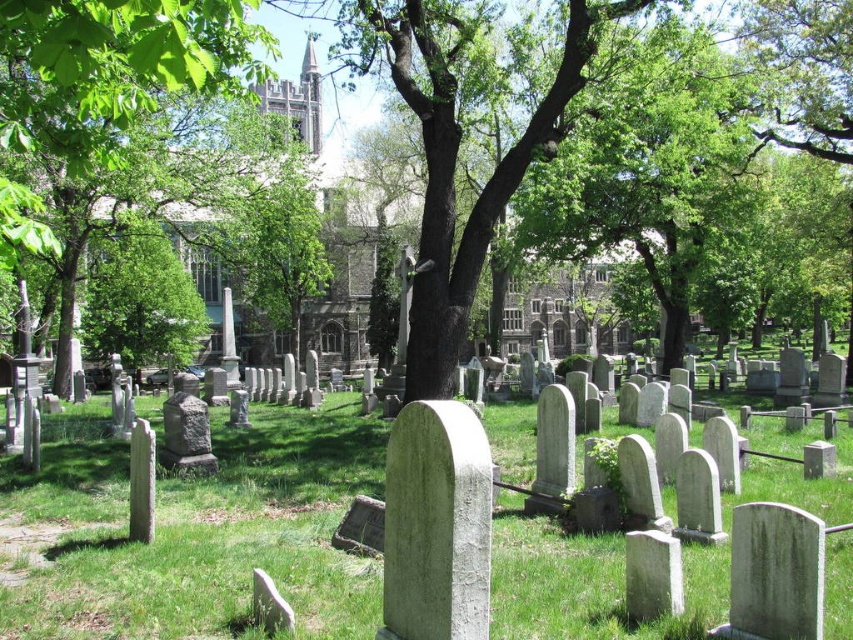
Question: Is green grassy at center thinner than green leafy tree at center?

Choices:
 (A) no
 (B) yes

Answer: (B)

Question: Which point is closer to the camera?

Choices:
 (A) (546, 589)
 (B) (44, 248)

Answer: (A)

Question: Among these points, which one is nearest to the camera?

Choices:
 (A) (257, 467)
 (B) (245, 54)

Answer: (B)

Question: Is green grassy at center thinner than green leafy tree at center?

Choices:
 (A) yes
 (B) no

Answer: (A)

Question: Is the position of green grassy at center less distant than that of green leafy tree at center?

Choices:
 (A) yes
 (B) no

Answer: (B)

Question: Which object appears closest to the camera in this image?

Choices:
 (A) green leafy tree at center
 (B) green grassy at center

Answer: (A)